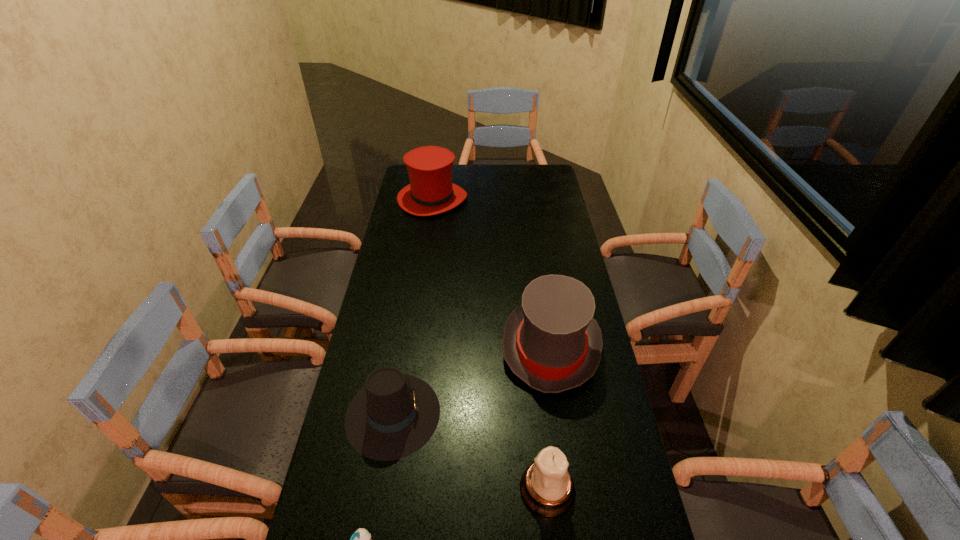
The image size is (960, 540). I want to click on candle holder that is at the right edge, so click(547, 488).

I want to click on object that is at the far left corner, so click(431, 191).

Identify the location of vacant space at the far edge of the desktop. (458, 173).

In the image, there is a desktop. At what (x,y) coordinates should I click in order to perform the action: click on free region at the left edge. Please return your answer as a coordinate pair (x, y). The width and height of the screenshot is (960, 540). Looking at the image, I should click on (353, 472).

Where is `vacant area at the right edge`? The height and width of the screenshot is (540, 960). vacant area at the right edge is located at coordinates (591, 427).

Where is `blank space at the far right corner of the desktop`? Image resolution: width=960 pixels, height=540 pixels. blank space at the far right corner of the desktop is located at coordinates (523, 167).

This screenshot has width=960, height=540. Identify the location of blank region between the candle holder and the farthest object. (490, 344).

Locate an element on the screen. free space between the rightmost hat and the farthest hat is located at coordinates (492, 273).

Locate an element on the screen. The width and height of the screenshot is (960, 540). vacant space that's between the candle holder and the rightmost hat is located at coordinates (549, 418).

Locate an element on the screen. The width and height of the screenshot is (960, 540). free space between the candle holder and the shortest hat is located at coordinates (470, 451).